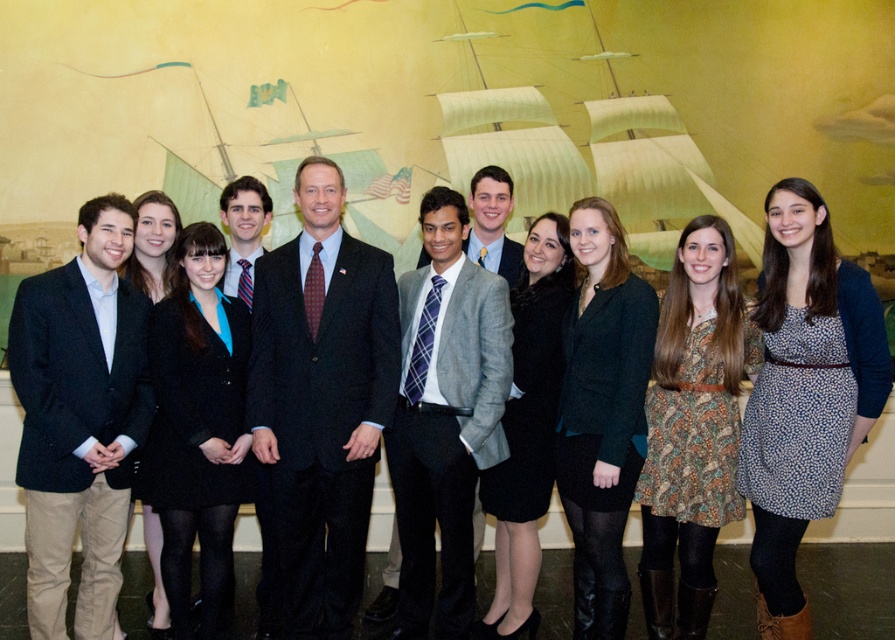
You are a photographer arranging a group photo. You have two central subjects wearing the dark green textured blazer at center and the black wool dress at center. To ensure both are equally visible, which clothing item should you move closer to the camera?

Since the dark green textured blazer at center has a lesser width compared to the black wool dress at center, you should move the dark green textured blazer at center closer to the camera to make it appear larger and balance visibility with the wider black wool dress at center.

You are organizing a photo shoot and need to ensure that the matte black suit at left and the black wool coat at center are visible in the final image. Given their sizes, which one might require more space in the frame to be fully captured?

The matte black suit at left has a larger size compared to the black wool coat at center, so it would require more space in the frame to be fully captured.

Looking at this image, you are a photographer adjusting the camera settings to ensure both the gray wool blazer at center and the black wool coat at center are in focus. Which clothing item requires you to adjust the focus to a closer distance due to its size?

The gray wool blazer at center is larger than the black wool coat at center, so you should adjust the focus to a closer distance for the gray wool blazer at center to ensure it is in focus.